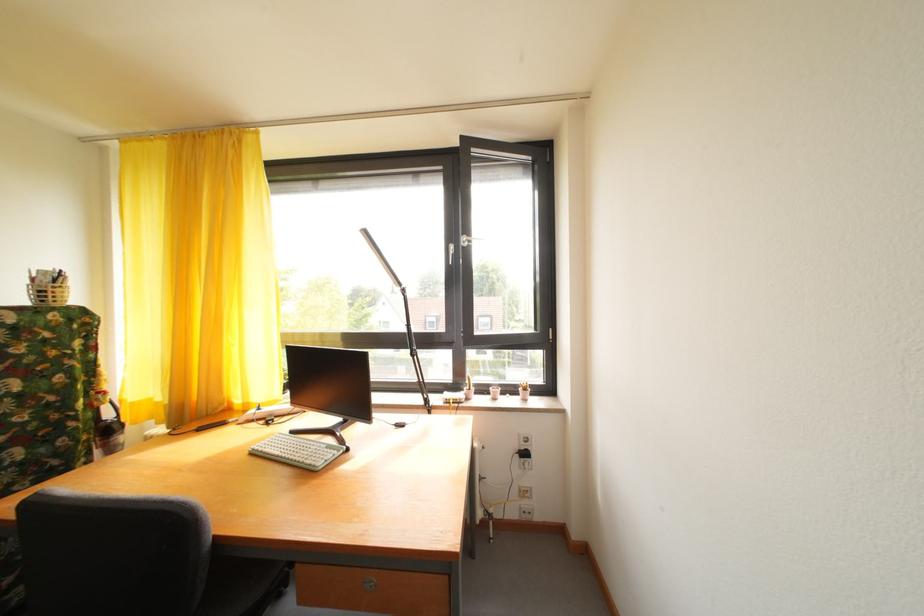
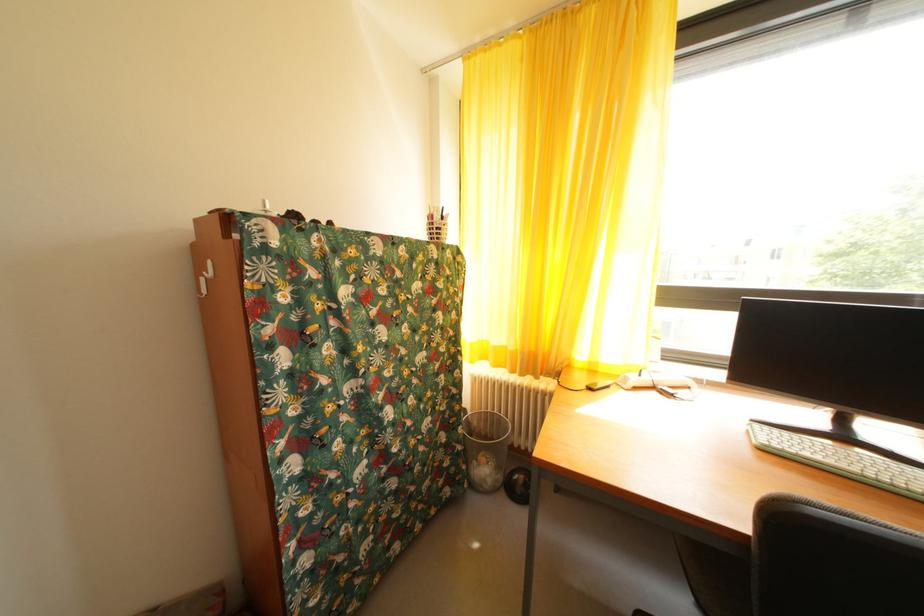
Where in the second image is the point corresponding to point (286, 459) from the first image?

(854, 472)